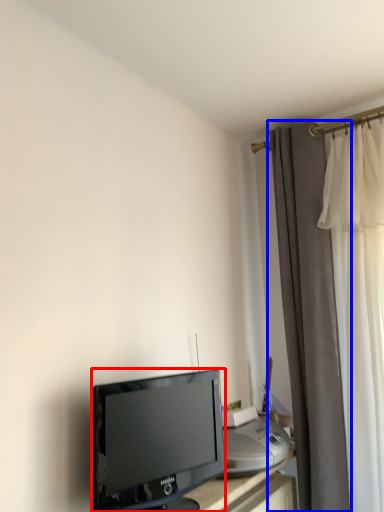
Question: Which object appears farthest to the camera in this image, television (highlighted by a red box) or curtain (highlighted by a blue box)?

Choices:
 (A) television
 (B) curtain

Answer: (B)